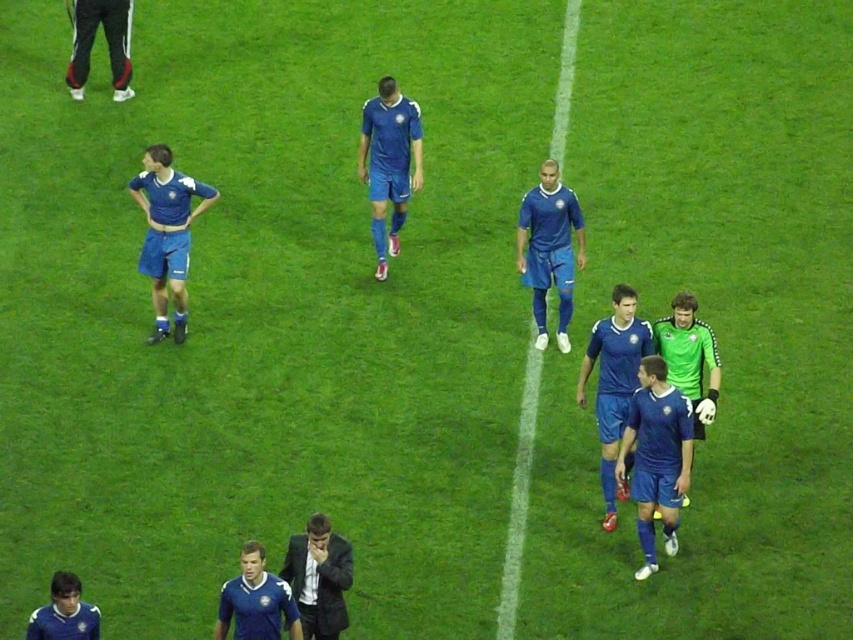
Question: Observing the image, what is the correct spatial positioning of matte blue uniform at center in reference to black track pants at upper left?

Choices:
 (A) left
 (B) right

Answer: (B)

Question: Which object is farther from the camera taking this photo?

Choices:
 (A) blue jersey at lower left
 (B) matte blue uniform at center
 (C) blue jersey at center

Answer: (B)

Question: Where is blue matte soccer player at center located in relation to blue jersey at center in the image?

Choices:
 (A) below
 (B) above

Answer: (B)

Question: Which of the following is the farthest from the observer?

Choices:
 (A) (648, 438)
 (B) (248, 612)

Answer: (A)

Question: Can you confirm if blue matte soccer jersey at center is bigger than matte blue uniform at center?

Choices:
 (A) yes
 (B) no

Answer: (B)

Question: Which object is closer to the camera taking this photo?

Choices:
 (A) blue jersey at center
 (B) blue fabric soccer uniform at center

Answer: (A)